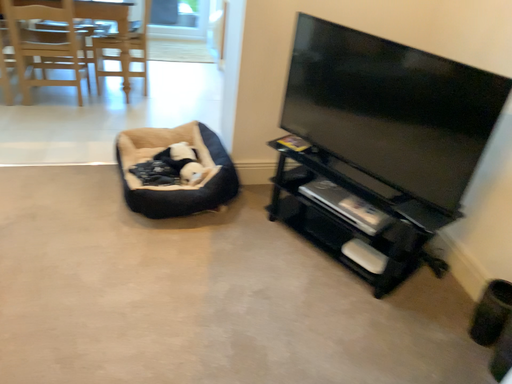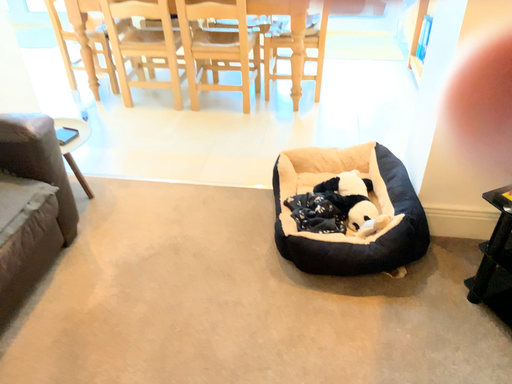
Question: How did the camera likely rotate when shooting the video?

Choices:
 (A) rotated left
 (B) rotated right

Answer: (A)